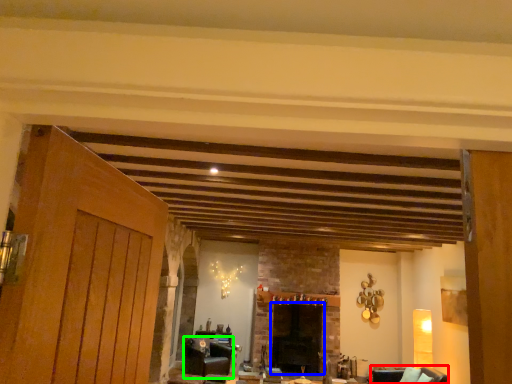
Question: Estimate the real-world distances between objects in this image. Which object is closer to armchair (highlighted by a red box), fireplace (highlighted by a blue box) or furniture (highlighted by a green box)?

Choices:
 (A) fireplace
 (B) furniture

Answer: (A)